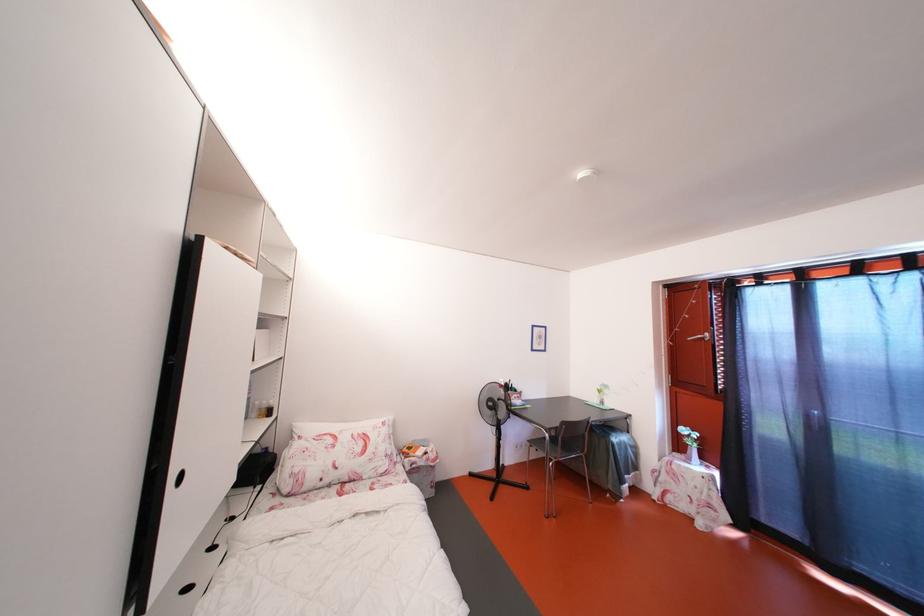
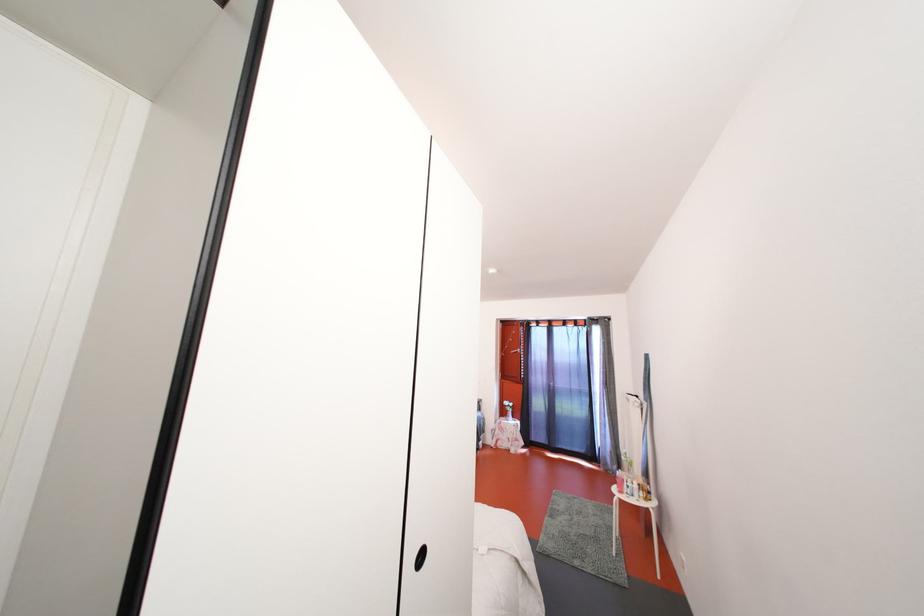
The point at (686, 451) is marked in the first image. Where is the corresponding point in the second image?

(509, 418)